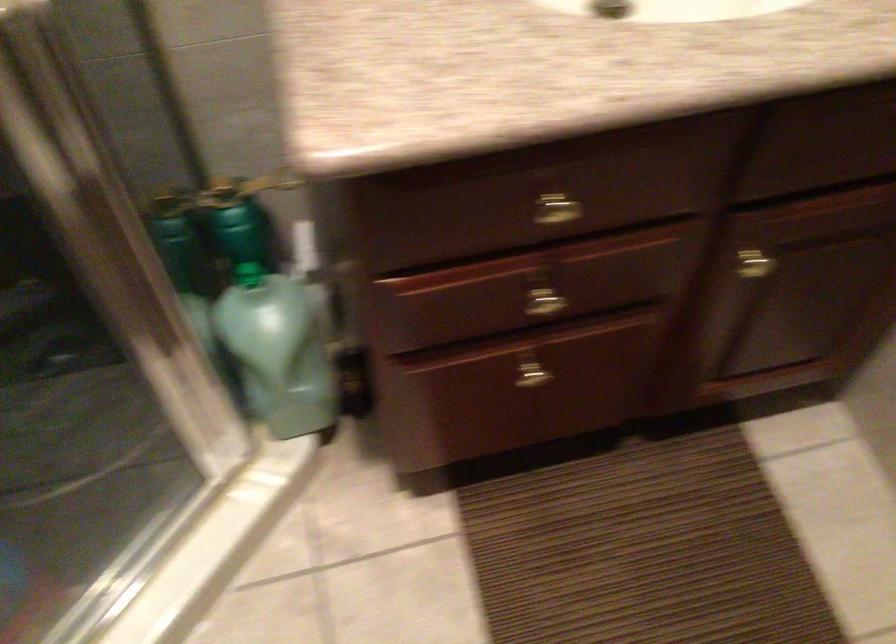
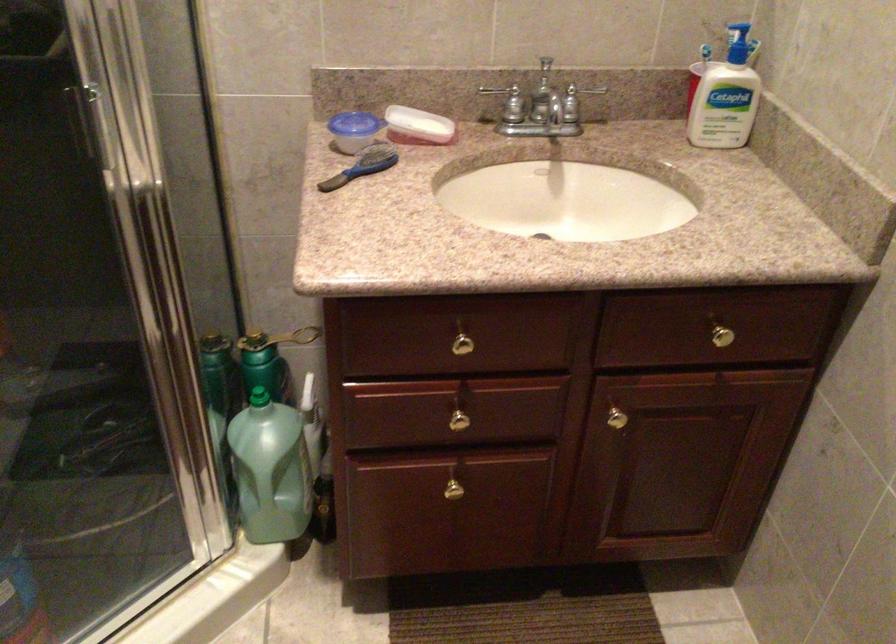
In the second image, find the point that corresponds to point (535, 374) in the first image.

(455, 488)